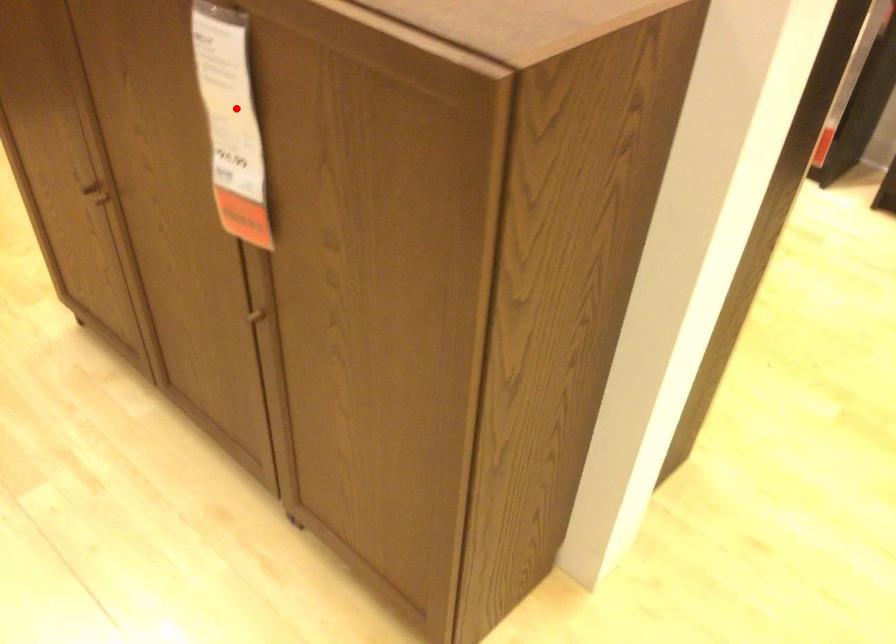
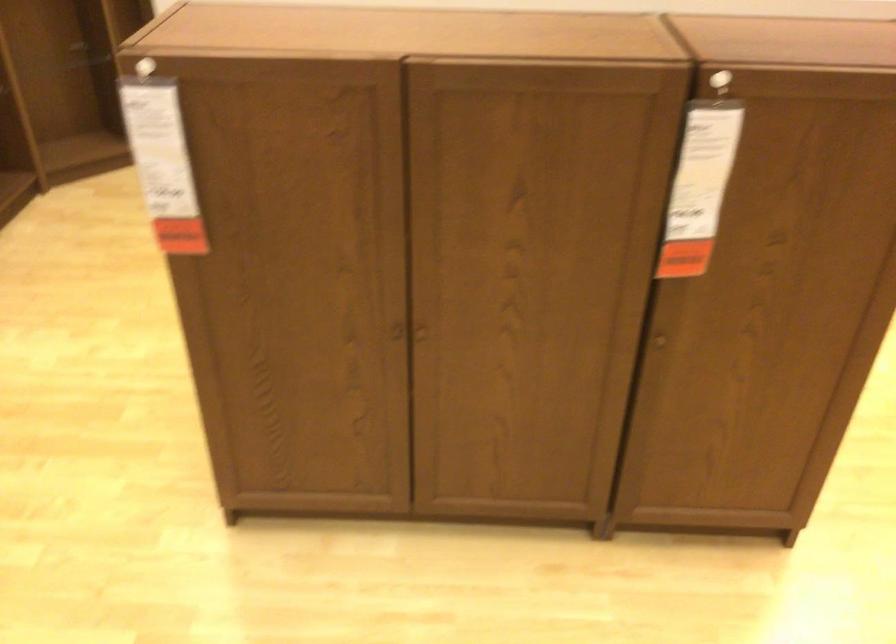
Where in the second image is the point corresponding to the highlighted location from the first image?

(702, 169)